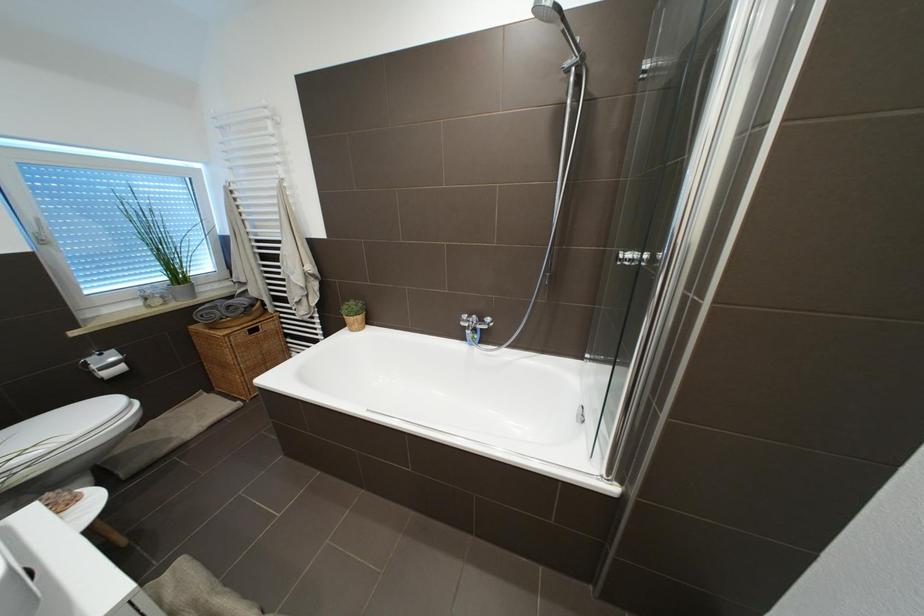
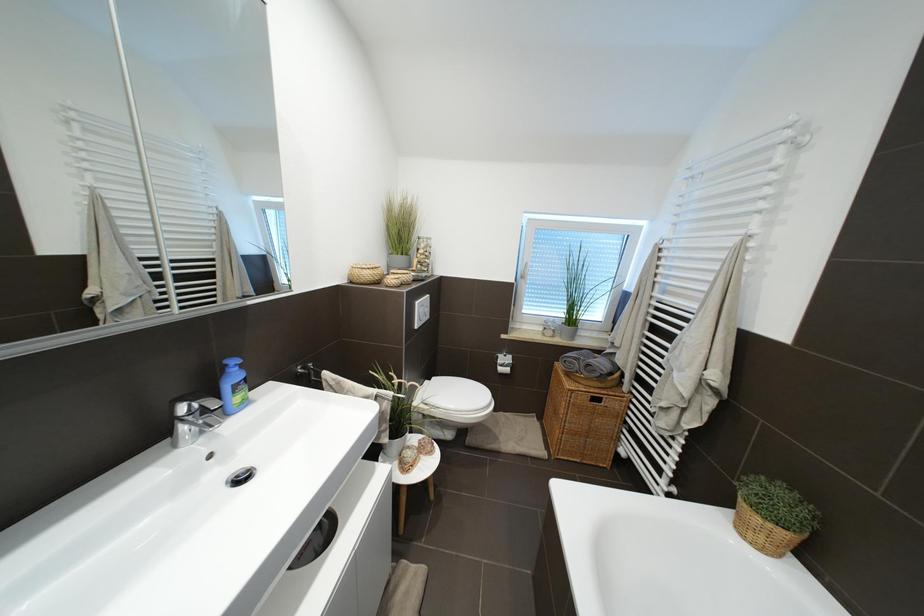
Question: The camera is either moving clockwise (left) or counter-clockwise (right) around the object. The first image is from the beginning of the video and the second image is from the end. Is the camera moving left or right when shooting the video?

Choices:
 (A) Left
 (B) Right

Answer: (B)